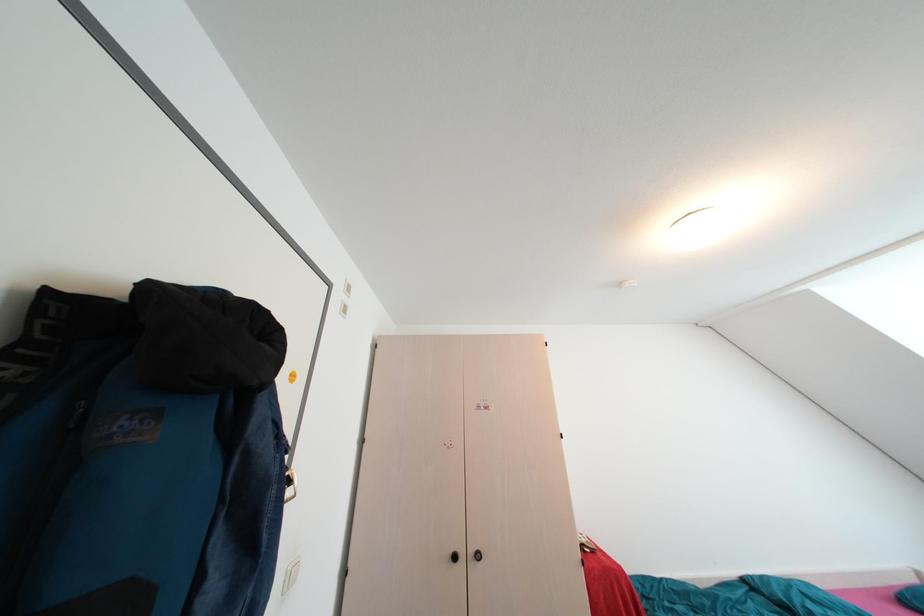
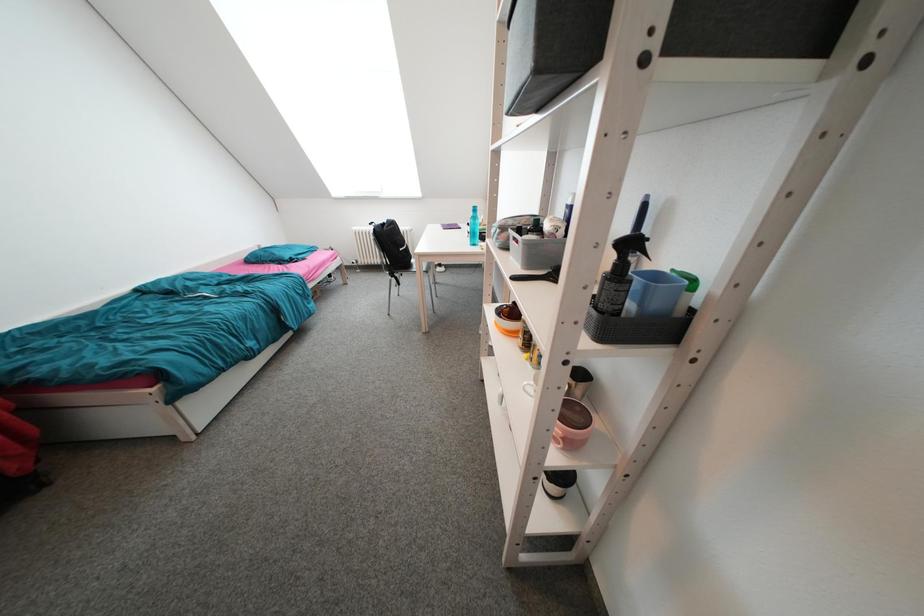
Based on the continuous images, in which direction is the camera rotating?

The rotation direction of the camera is right-down.